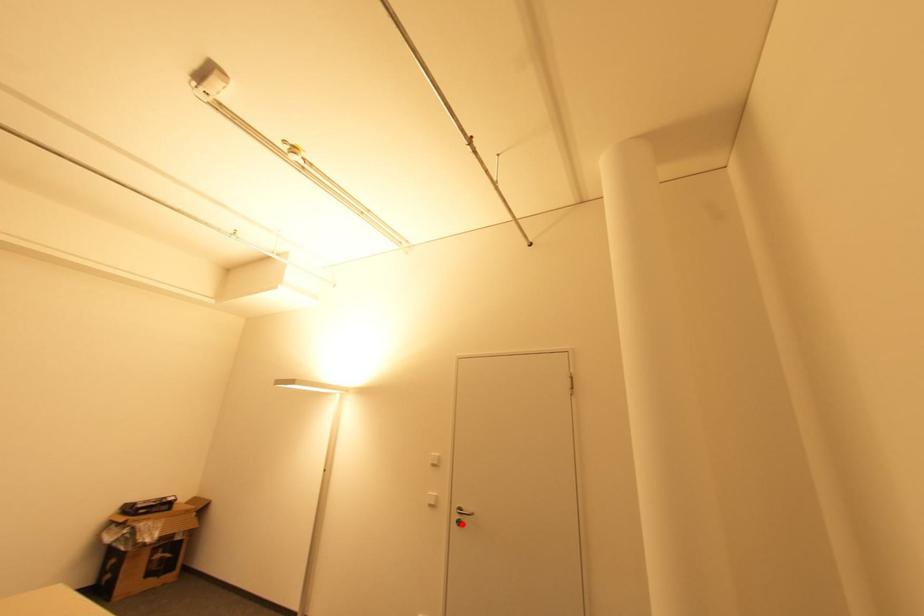
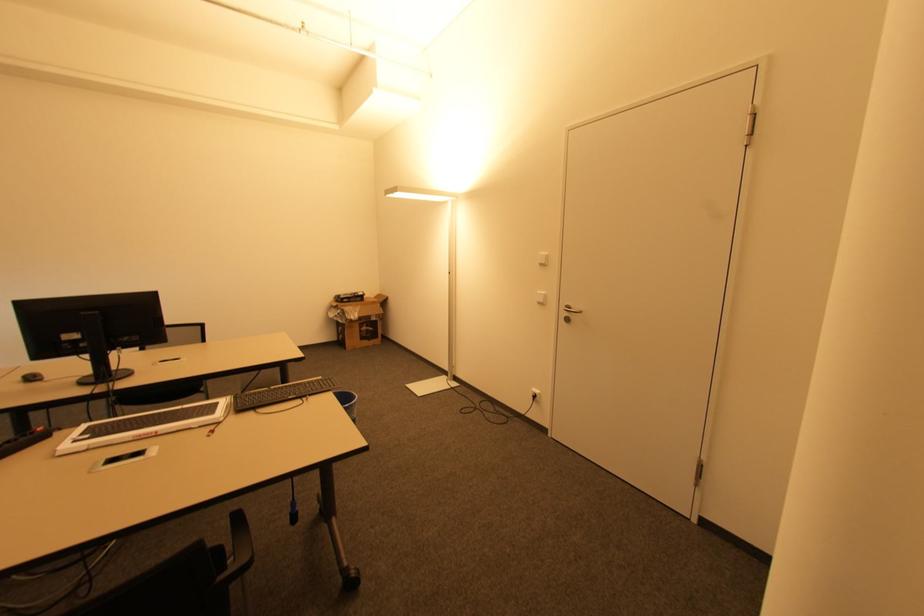
In the second image, find the point that corresponds to the highlighted location in the first image.

(568, 320)